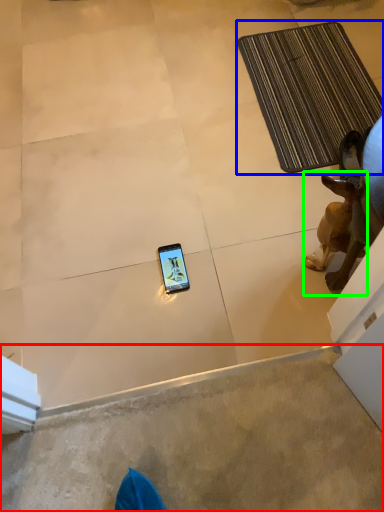
Question: Which object is positioned closest to concrete (highlighted by a red box)? Select from bath mat (highlighted by a blue box) and dog (highlighted by a green box).

Choices:
 (A) bath mat
 (B) dog

Answer: (B)